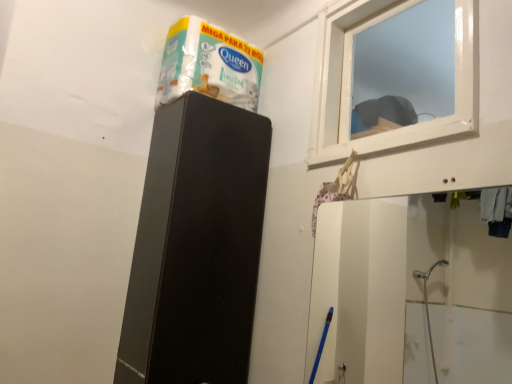
Describe the element at coordinates (209, 65) in the screenshot. I see `white glossy tissue box at upper center` at that location.

Measure the distance between transparent plastic window at upper right and camera.

A distance of 3.63 feet exists between transparent plastic window at upper right and camera.

What do you see at coordinates (196, 246) in the screenshot? This screenshot has height=384, width=512. I see `black matte speaker at upper center` at bounding box center [196, 246].

At what (x,y) coordinates should I click in order to perform the action: click on white glossy tissue box at upper center. Please return your answer as a coordinate pair (x, y). Looking at the image, I should click on (209, 65).

Is transparent plastic window at upper right positioned beyond the bounds of white glossy tissue box at upper center?

Yes, transparent plastic window at upper right is located beyond the bounds of white glossy tissue box at upper center.

From the image's perspective, which is below, transparent plastic window at upper right or white glossy tissue box at upper center?

transparent plastic window at upper right is shown below in the image.

How many degrees apart are the facing directions of transparent plastic window at upper right and white glossy tissue box at upper center?

They differ by 90 degrees in their facing directions.

Is point (455, 43) less distant than point (248, 44)?

No, (455, 43) is further to viewer.

Could you tell me if white glossy tissue box at upper center is turned towards black matte speaker at upper center?

No, white glossy tissue box at upper center is not turned towards black matte speaker at upper center.

Based on their positions, is white glossy tissue box at upper center located to the left or right of black matte speaker at upper center?

white glossy tissue box at upper center is positioned on black matte speaker at upper center's right side.

Which object is closer to the camera taking this photo, white glossy tissue box at upper center or black matte speaker at upper center?

black matte speaker at upper center.

In the image, is black matte speaker at upper center positioned in front of or behind white glossy tissue box at upper center?

black matte speaker at upper center is positioned closer to the viewer than white glossy tissue box at upper center.

Is black matte speaker at upper center thinner than white glossy tissue box at upper center?

No, black matte speaker at upper center is not thinner than white glossy tissue box at upper center.

Is white glossy tissue box at upper center completely or partially inside black matte speaker at upper center?

That's incorrect, white glossy tissue box at upper center is not inside black matte speaker at upper center.

Is black matte speaker at upper center next to white glossy tissue box at upper center?

black matte speaker at upper center and white glossy tissue box at upper center are not in contact.

Who is bigger, black matte speaker at upper center or transparent plastic window at upper right?

With larger size is black matte speaker at upper center.

Considering the sizes of objects black matte speaker at upper center and transparent plastic window at upper right in the image provided, who is taller, black matte speaker at upper center or transparent plastic window at upper right?

black matte speaker at upper center is taller.

How different are the orientations of black matte speaker at upper center and transparent plastic window at upper right in degrees?

The angular difference between black matte speaker at upper center and transparent plastic window at upper right is 91.3 degrees.

Is transparent plastic window at upper right surrounded by black matte speaker at upper center?

No, transparent plastic window at upper right is located outside of black matte speaker at upper center.

Locate an element on the screen. product that is on the left side of transparent plastic window at upper right is located at coordinates click(209, 65).

Is white glossy tissue box at upper center taller than transparent plastic window at upper right?

No, white glossy tissue box at upper center is not taller than transparent plastic window at upper right.

From a real-world perspective, between white glossy tissue box at upper center and transparent plastic window at upper right, who is vertically lower?

In real-world perspective, transparent plastic window at upper right is lower.

Is white glossy tissue box at upper center situated inside transparent plastic window at upper right or outside?

white glossy tissue box at upper center lies outside transparent plastic window at upper right.

Is transparent plastic window at upper right not near black matte speaker at upper center?

No, there isn't a large distance between transparent plastic window at upper right and black matte speaker at upper center.

From the image's perspective, is transparent plastic window at upper right below black matte speaker at upper center?

No.

From a real-world perspective, between transparent plastic window at upper right and black matte speaker at upper center, who is vertically lower?

From a 3D spatial view, black matte speaker at upper center is below.

Could you measure the distance between transparent plastic window at upper right and black matte speaker at upper center?

transparent plastic window at upper right is 21.33 inches away from black matte speaker at upper center.

The image size is (512, 384). Find the location of `product behind the transparent plastic window at upper right`. product behind the transparent plastic window at upper right is located at coordinates (209, 65).

The height and width of the screenshot is (384, 512). What are the coordinates of `furniture below the white glossy tissue box at upper center (from a real-world perspective)` in the screenshot? It's located at (196, 246).

When comparing their distances from black matte speaker at upper center, does white glossy tissue box at upper center or transparent plastic window at upper right seem further?

transparent plastic window at upper right is positioned further to the anchor black matte speaker at upper center.

Based on their spatial positions, is black matte speaker at upper center or transparent plastic window at upper right further from white glossy tissue box at upper center?

Based on the image, transparent plastic window at upper right appears to be further to white glossy tissue box at upper center.

From the image, which object appears to be farther from black matte speaker at upper center, transparent plastic window at upper right or white glossy tissue box at upper center?

Among the two, transparent plastic window at upper right is located further to black matte speaker at upper center.

Considering their positions, is transparent plastic window at upper right positioned further to white glossy tissue box at upper center than black matte speaker at upper center?

transparent plastic window at upper right is further to white glossy tissue box at upper center.

When comparing their distances from transparent plastic window at upper right, does white glossy tissue box at upper center or black matte speaker at upper center seem closer?

The object closer to transparent plastic window at upper right is white glossy tissue box at upper center.

Looking at the image, which one is located closer to transparent plastic window at upper right, black matte speaker at upper center or white glossy tissue box at upper center?

white glossy tissue box at upper center is closer to transparent plastic window at upper right.

Where is `window between white glossy tissue box at upper center and black matte speaker at upper center in the up-down direction`? window between white glossy tissue box at upper center and black matte speaker at upper center in the up-down direction is located at coordinates (351, 78).